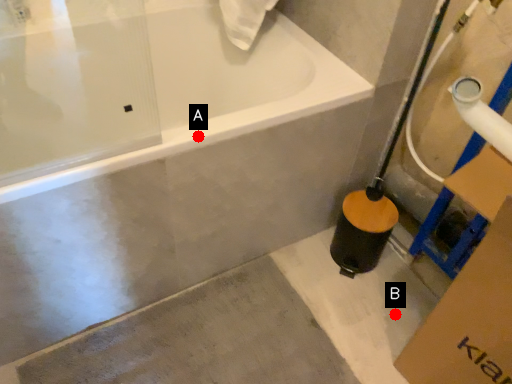
Question: Two points are circled on the image, labeled by A and B beside each circle. Which point is farther to the camera?

Choices:
 (A) A is further
 (B) B is further

Answer: (B)